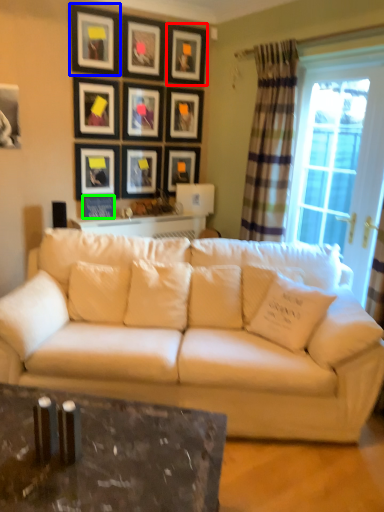
Question: Which is farther away from picture frame (highlighted by a red box)? picture frame (highlighted by a blue box) or picture frame (highlighted by a green box)?

Choices:
 (A) picture frame
 (B) picture frame

Answer: (B)